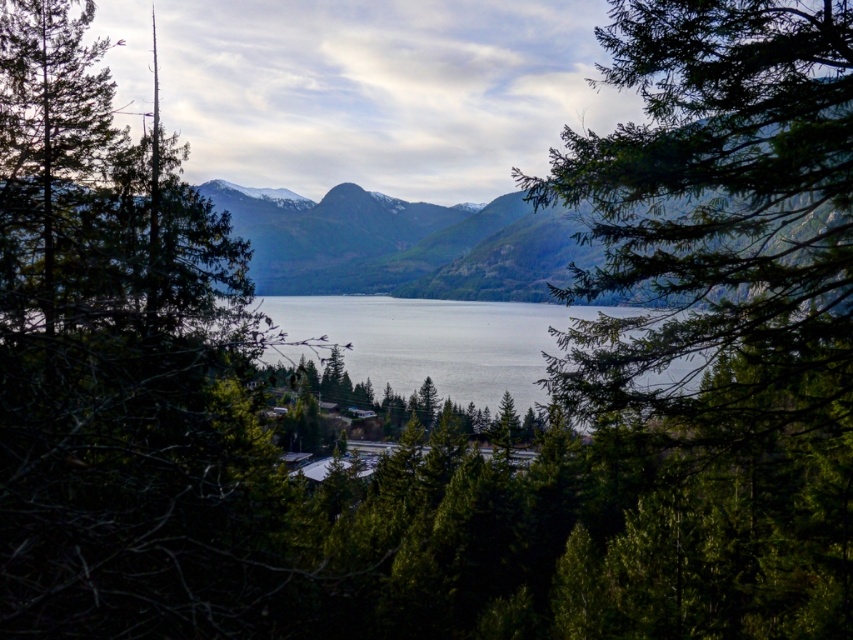
Is green needle-like leaves at center smaller than green textured mountain at center?

Yes.

Does green needle-like leaves at center have a lesser height compared to green textured mountain at center?

No, green needle-like leaves at center is not shorter than green textured mountain at center.

What are the coordinates of `green needle-like leaves at center` in the screenshot? It's located at click(x=717, y=218).

At what (x,y) coordinates should I click in order to perform the action: click on green needle-like leaves at center. Please return your answer as a coordinate pair (x, y). Looking at the image, I should click on (717, 218).

Does green textured mountain at center have a greater width compared to green matte tree at left?

Yes.

Who is positioned more to the right, green textured mountain at center or green matte tree at left?

From the viewer's perspective, green textured mountain at center appears more on the right side.

Which is in front, point (325, 269) or point (4, 129)?

Point (4, 129)

The height and width of the screenshot is (640, 853). In order to click on green textured mountain at center in this screenshot , I will do `click(402, 244)`.

Is point (758, 230) closer to camera compared to point (36, 145)?

Yes, it is.

Is green needle-like leaves at center smaller than green matte tree at left?

Yes, green needle-like leaves at center is smaller than green matte tree at left.

Describe the element at coordinates (717, 218) in the screenshot. This screenshot has width=853, height=640. I see `green needle-like leaves at center` at that location.

The height and width of the screenshot is (640, 853). I want to click on green needle-like leaves at center, so [717, 218].